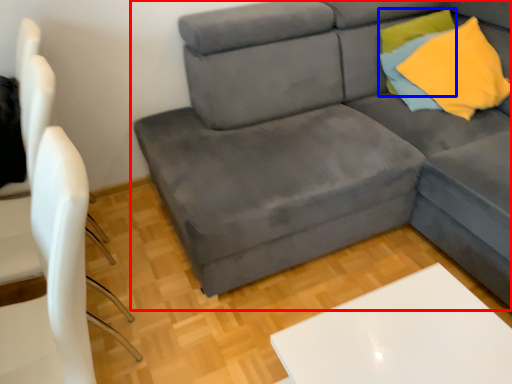
Question: Among these objects, which one is farthest to the camera, studio couch (highlighted by a red box) or pillow (highlighted by a blue box)?

Choices:
 (A) studio couch
 (B) pillow

Answer: (B)